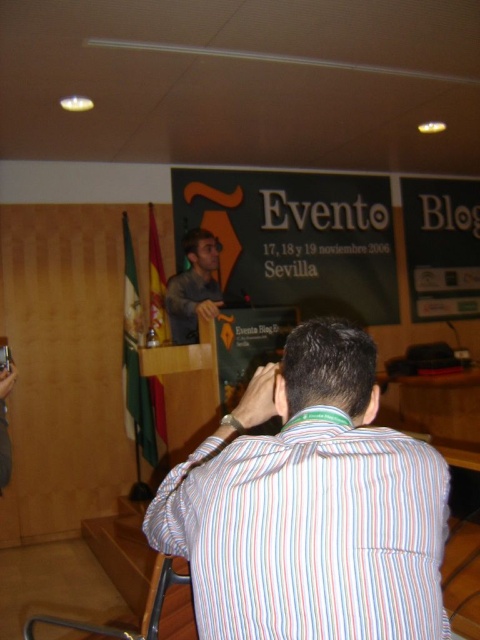
Which is behind, point (242, 561) or point (207, 280)?

Positioned behind is point (207, 280).

Between point (419, 628) and point (216, 260), which one is positioned behind?

Positioned behind is point (216, 260).

This screenshot has height=640, width=480. I want to click on striped cotton shirt at back, so click(310, 532).